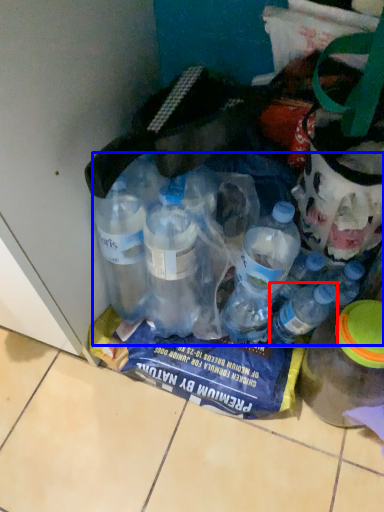
Question: Which of the following is the farthest to the observer, bottle (highlighted by a red box) or bottle (highlighted by a blue box)?

Choices:
 (A) bottle
 (B) bottle

Answer: (A)